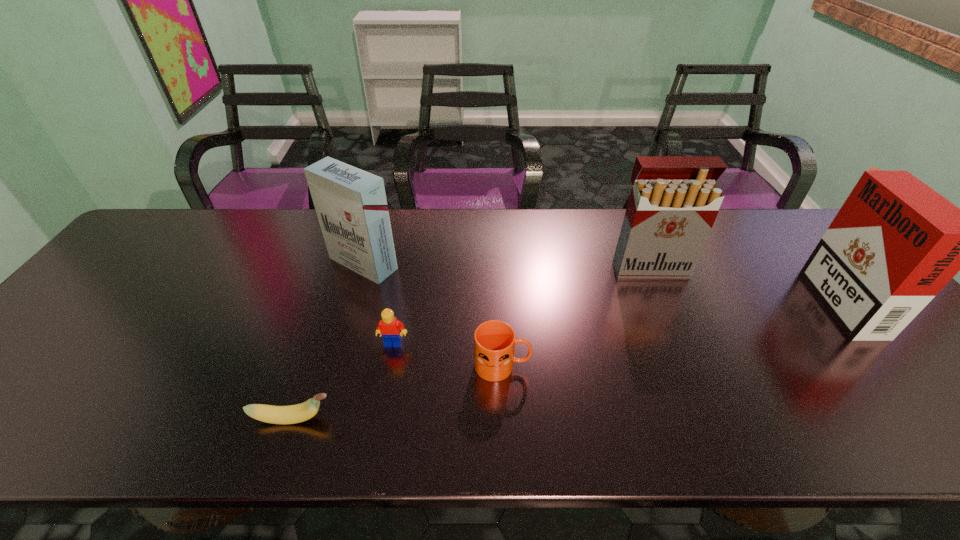
Find the location of a particular element. Image resolution: width=960 pixels, height=540 pixels. empty space between the nearest object and the fifth object from left to right is located at coordinates coord(471,343).

You are a GUI agent. You are given a task and a screenshot of the screen. Output one action in this format:
    pyautogui.click(x=<x>, y=<y>)
    Task: Click on the empty space between the banana and the fourth object from left to right
    
    Given the screenshot: What is the action you would take?
    pyautogui.click(x=397, y=392)

Find the location of a particular element. unoccupied position between the Lego and the mug is located at coordinates tap(448, 355).

I want to click on free space that is in between the Lego and the banana, so click(344, 381).

Point out which object is positioned as the nearest to the shortest object. Please provide its 2D coordinates. Your answer should be formatted as a tuple, i.e. [(x, y)], where the tuple contains the x and y coordinates of a point satisfying the conditions above.

[(389, 327)]

Identify which object is located as the fifth nearest to the banana. Please provide its 2D coordinates. Your answer should be formatted as a tuple, i.e. [(x, y)], where the tuple contains the x and y coordinates of a point satisfying the conditions above.

[(895, 243)]

Find the location of a particular element. cigarette case that is the closest to the Lego is located at coordinates (351, 205).

Identify the location of cigarette case that is the third closest to the second nearest object. The image size is (960, 540). (895, 243).

This screenshot has width=960, height=540. Identify the location of vacant area in the image that satisfies the following two spatial constraints: 1. with the lid open on the second cigarette case from left to right; 2. on the handle side of the mug. point(690,366).

Image resolution: width=960 pixels, height=540 pixels. What are the coordinates of `blank area in the image that satisfies the following two spatial constraints: 1. on the face of the Lego; 2. at the stem of the nearest object` in the screenshot? It's located at (379, 419).